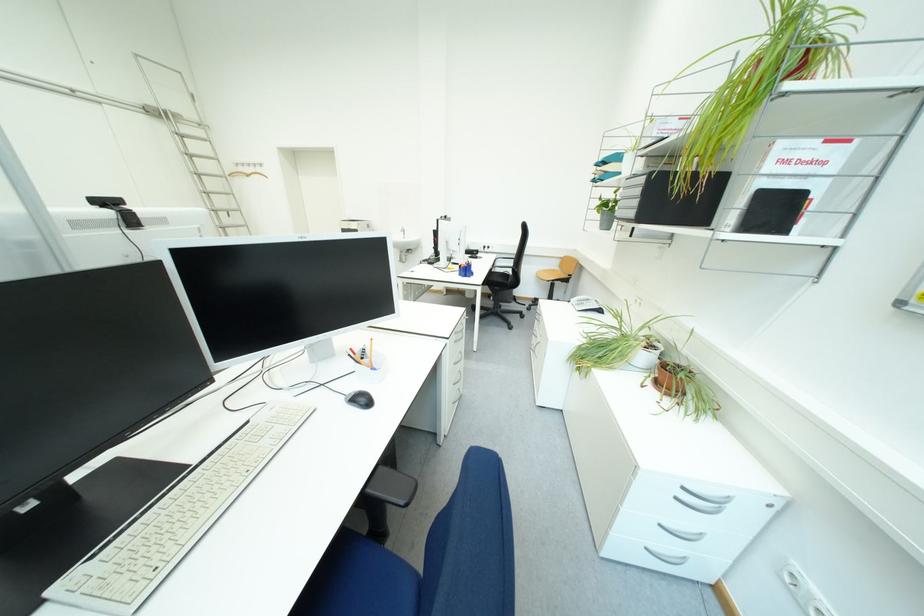
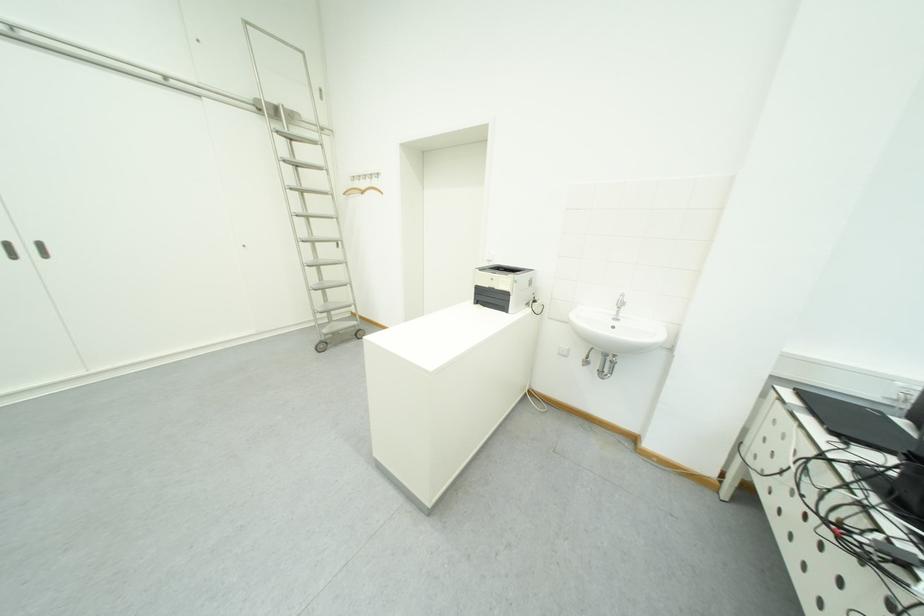
Where in the second image is the point corresponding to pixel 258 172 from the first image?

(372, 185)